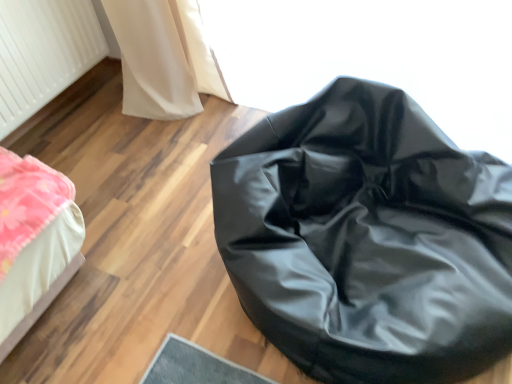
Question: From a real-world perspective, is black leather bean bag at center over white textured radiator at upper left?

Choices:
 (A) yes
 (B) no

Answer: (B)

Question: Is black leather bean bag at center shorter than white textured radiator at upper left?

Choices:
 (A) no
 (B) yes

Answer: (A)

Question: Can you confirm if black leather bean bag at center is smaller than white textured radiator at upper left?

Choices:
 (A) yes
 (B) no

Answer: (B)

Question: Can you confirm if black leather bean bag at center is positioned to the left of white textured radiator at upper left?

Choices:
 (A) no
 (B) yes

Answer: (A)

Question: Can you confirm if black leather bean bag at center is wider than white textured radiator at upper left?

Choices:
 (A) yes
 (B) no

Answer: (A)

Question: From the image's perspective, is black leather bean bag at center located beneath white textured radiator at upper left?

Choices:
 (A) no
 (B) yes

Answer: (B)

Question: Can you confirm if white textured radiator at upper left is thinner than black leather bean bag at center?

Choices:
 (A) no
 (B) yes

Answer: (B)

Question: Is white textured radiator at upper left taller than black leather bean bag at center?

Choices:
 (A) no
 (B) yes

Answer: (A)

Question: From the image's perspective, is white textured radiator at upper left on black leather bean bag at center?

Choices:
 (A) no
 (B) yes

Answer: (B)

Question: Does white textured radiator at upper left have a lesser height compared to black leather bean bag at center?

Choices:
 (A) yes
 (B) no

Answer: (A)

Question: Is black leather bean bag at center a part of white textured radiator at upper left?

Choices:
 (A) yes
 (B) no

Answer: (B)

Question: Is white textured radiator at upper left wider than black leather bean bag at center?

Choices:
 (A) yes
 (B) no

Answer: (B)

Question: Considering the relative positions of white textured radiator at upper left and black leather bean bag at center in the image provided, is white textured radiator at upper left to the left or to the right of black leather bean bag at center?

Choices:
 (A) right
 (B) left

Answer: (B)